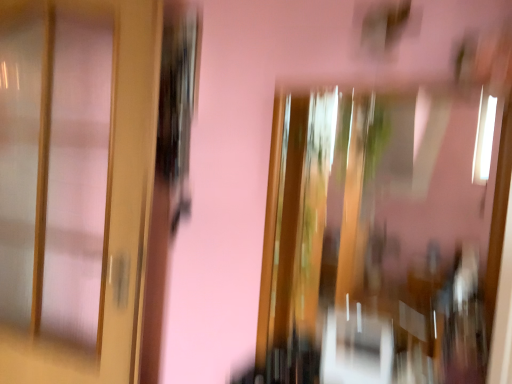
Question: Considering the relative sizes of matte wood door at left and transparent glass window at center in the image provided, is matte wood door at left shorter than transparent glass window at center?

Choices:
 (A) yes
 (B) no

Answer: (B)

Question: From the image's perspective, is matte wood door at left located above transparent glass window at center?

Choices:
 (A) yes
 (B) no

Answer: (A)

Question: From a real-world perspective, is matte wood door at left located beneath transparent glass window at center?

Choices:
 (A) no
 (B) yes

Answer: (A)

Question: Does matte wood door at left have a larger size compared to transparent glass window at center?

Choices:
 (A) yes
 (B) no

Answer: (A)

Question: Considering the relative sizes of matte wood door at left and transparent glass window at center in the image provided, is matte wood door at left wider than transparent glass window at center?

Choices:
 (A) yes
 (B) no

Answer: (A)

Question: Is matte wood door at left oriented away from transparent glass window at center?

Choices:
 (A) yes
 (B) no

Answer: (B)

Question: Is transparent glass window at center positioned before matte wood door at left?

Choices:
 (A) yes
 (B) no

Answer: (A)

Question: Is transparent glass window at center positioned with its back to matte wood door at left?

Choices:
 (A) no
 (B) yes

Answer: (A)

Question: Does transparent glass window at center contain matte wood door at left?

Choices:
 (A) no
 (B) yes

Answer: (A)

Question: Is transparent glass window at center to the right of matte wood door at left from the viewer's perspective?

Choices:
 (A) no
 (B) yes

Answer: (B)

Question: Is transparent glass window at center positioned far away from matte wood door at left?

Choices:
 (A) no
 (B) yes

Answer: (B)

Question: From a real-world perspective, is transparent glass window at center under matte wood door at left?

Choices:
 (A) yes
 (B) no

Answer: (A)

Question: Looking at their shapes, would you say matte wood door at left is wider or thinner than transparent glass window at center?

Choices:
 (A) wide
 (B) thin

Answer: (A)